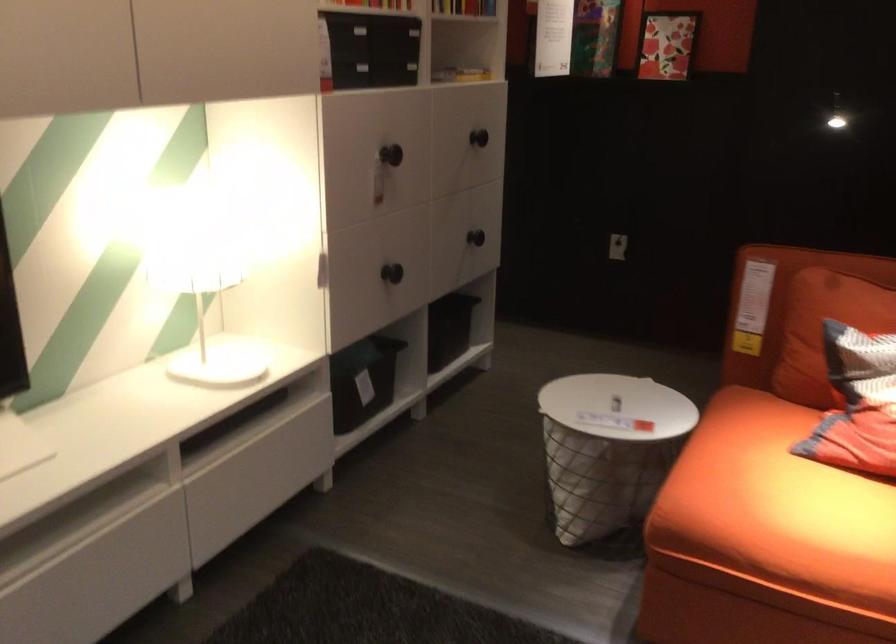
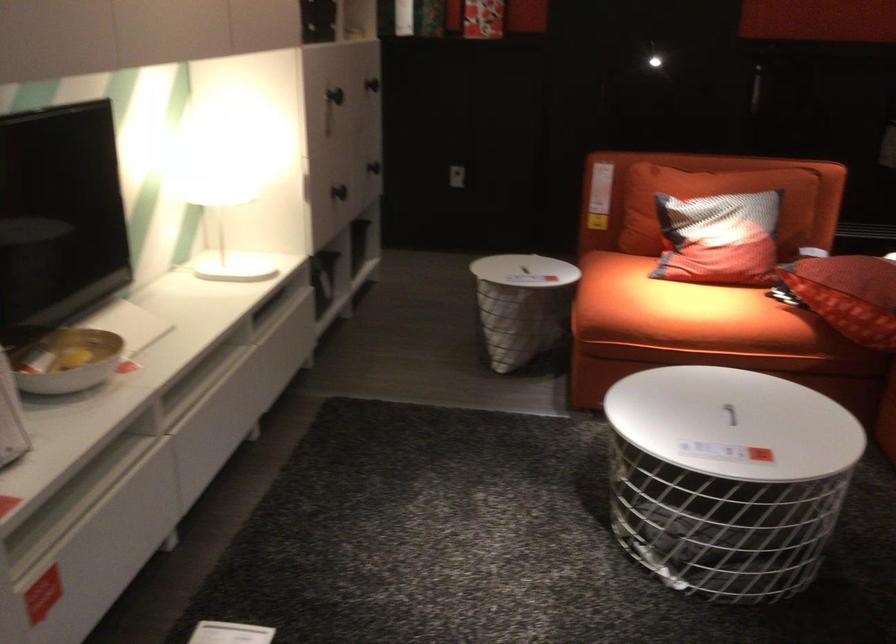
The point at [608,402] is marked in the first image. Where is the corresponding point in the second image?

(522, 270)